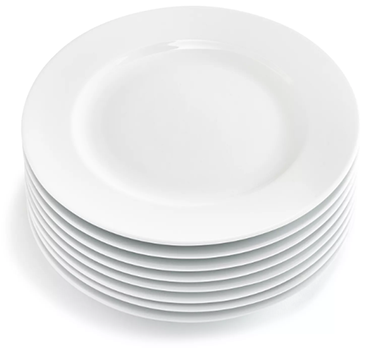
The height and width of the screenshot is (350, 382). I want to click on edge of white plate, so click(271, 304), click(270, 296), click(268, 287), click(265, 277), click(265, 266), click(264, 256), click(263, 243), click(262, 229).